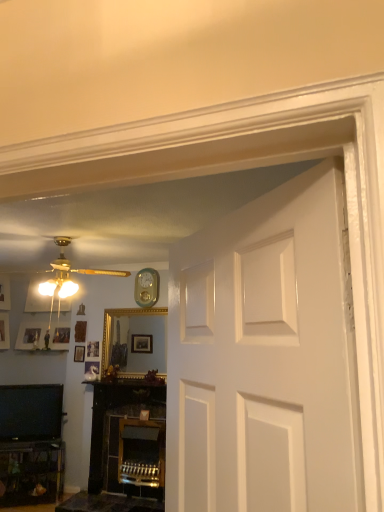
Question: Does black glossy television at lower left turn towards wooden picture frame at center?

Choices:
 (A) yes
 (B) no

Answer: (B)

Question: From a real-world perspective, is black glossy television at lower left physically below wooden picture frame at center?

Choices:
 (A) yes
 (B) no

Answer: (A)

Question: Is black glossy television at lower left with wooden picture frame at center?

Choices:
 (A) yes
 (B) no

Answer: (B)

Question: Considering the relative sizes of black glossy television at lower left and wooden picture frame at center in the image provided, is black glossy television at lower left smaller than wooden picture frame at center?

Choices:
 (A) no
 (B) yes

Answer: (A)

Question: Considering the relative positions of black glossy television at lower left and wooden picture frame at center in the image provided, is black glossy television at lower left behind wooden picture frame at center?

Choices:
 (A) no
 (B) yes

Answer: (A)

Question: From the image's perspective, is black glossy television at lower left above wooden picture frame at center?

Choices:
 (A) no
 (B) yes

Answer: (A)

Question: Can you confirm if matte gold ceiling fan at upper left is bigger than gold metallic ceiling fan at upper left?

Choices:
 (A) no
 (B) yes

Answer: (A)

Question: Does matte gold ceiling fan at upper left have a greater height compared to gold metallic ceiling fan at upper left?

Choices:
 (A) yes
 (B) no

Answer: (B)

Question: Is matte gold ceiling fan at upper left smaller than gold metallic ceiling fan at upper left?

Choices:
 (A) no
 (B) yes

Answer: (B)

Question: From a real-world perspective, is matte gold ceiling fan at upper left positioned over gold metallic ceiling fan at upper left based on gravity?

Choices:
 (A) no
 (B) yes

Answer: (A)

Question: Is matte gold ceiling fan at upper left to the left of gold metallic ceiling fan at upper left from the viewer's perspective?

Choices:
 (A) yes
 (B) no

Answer: (B)

Question: From the image's perspective, does matte gold ceiling fan at upper left appear lower than gold metallic ceiling fan at upper left?

Choices:
 (A) yes
 (B) no

Answer: (A)

Question: Would you say teal glossy clock at upper center is a long distance from wooden picture frame at center?

Choices:
 (A) yes
 (B) no

Answer: (A)